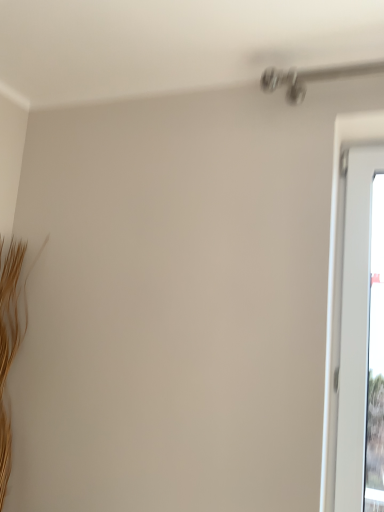
Question: Is transparent glass window at right bigger or smaller than brown textured twig at left?

Choices:
 (A) small
 (B) big

Answer: (A)

Question: Would you say transparent glass window at right is to the left or to the right of brown textured twig at left in the picture?

Choices:
 (A) left
 (B) right

Answer: (B)

Question: From the image's perspective, is transparent glass window at right above or below brown textured twig at left?

Choices:
 (A) below
 (B) above

Answer: (B)

Question: Looking at the image, does brown textured twig at left seem bigger or smaller compared to transparent glass window at right?

Choices:
 (A) small
 (B) big

Answer: (B)

Question: Considering the relative positions of brown textured twig at left and transparent glass window at right in the image provided, is brown textured twig at left to the left or to the right of transparent glass window at right?

Choices:
 (A) left
 (B) right

Answer: (A)

Question: Relative to transparent glass window at right, is brown textured twig at left in front or behind?

Choices:
 (A) front
 (B) behind

Answer: (B)

Question: Is brown textured twig at left inside or outside of transparent glass window at right?

Choices:
 (A) inside
 (B) outside

Answer: (B)